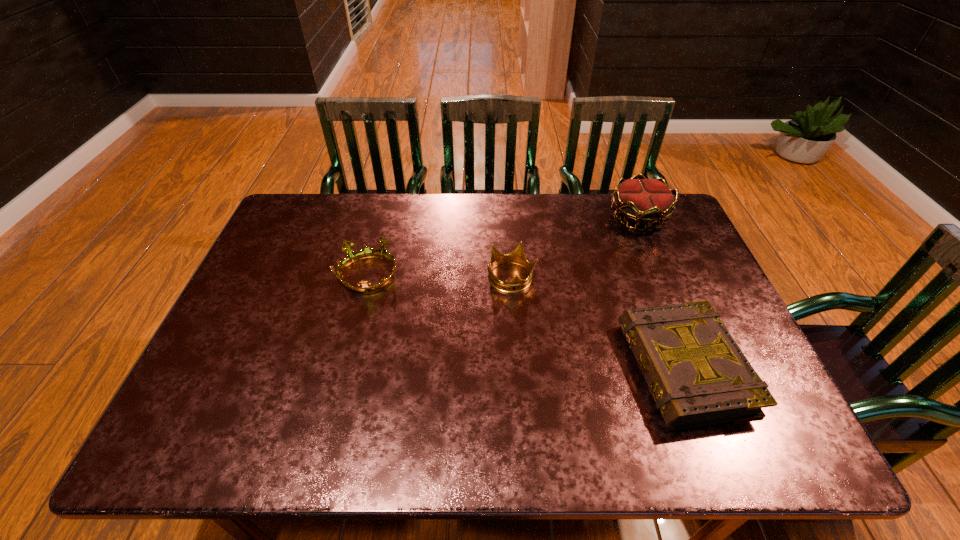
Locate an element on the screen. This screenshot has width=960, height=540. vacant area between the second crown from left to right and the rightmost crown is located at coordinates (575, 247).

Locate an element on the screen. Image resolution: width=960 pixels, height=540 pixels. vacant area that lies between the nearest object and the farthest crown is located at coordinates (661, 292).

You are a GUI agent. You are given a task and a screenshot of the screen. Output one action in this format:
    pyautogui.click(x=<x>, y=<y>)
    Task: Click on the vacant space in between the second crown from left to right and the leftmost object
    Image resolution: width=960 pixels, height=540 pixels.
    Given the screenshot: What is the action you would take?
    441,276

The height and width of the screenshot is (540, 960). Find the location of `unoccupied area between the leftmost object and the second crown from left to right`. unoccupied area between the leftmost object and the second crown from left to right is located at coordinates (441, 276).

Identify the location of free space between the second object from left to right and the hardback book. (597, 323).

Where is `free area in between the second crown from right to left and the leftmost crown`? free area in between the second crown from right to left and the leftmost crown is located at coordinates (441, 276).

The image size is (960, 540). Identify the location of free point between the leftmost crown and the third object from right to left. (441, 276).

Find the location of a particular element. The height and width of the screenshot is (540, 960). free space that is in between the farthest crown and the leftmost crown is located at coordinates (504, 246).

At what (x,y) coordinates should I click in order to perform the action: click on blank region between the second crown from right to left and the hardback book. Please return your answer as a coordinate pair (x, y). This screenshot has width=960, height=540. Looking at the image, I should click on (597, 323).

Locate an element on the screen. object that is the third nearest to the leftmost crown is located at coordinates (645, 201).